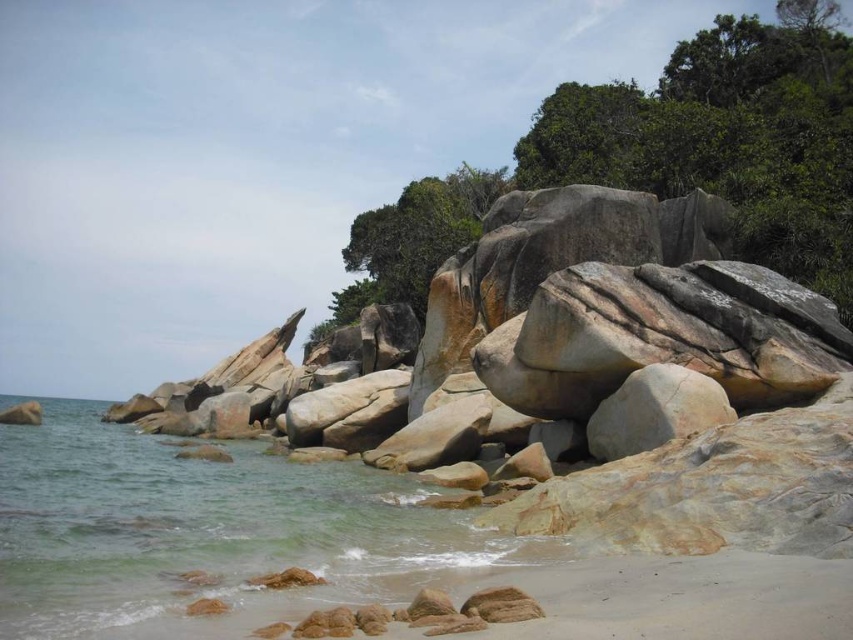
The image size is (853, 640). Describe the element at coordinates (651, 362) in the screenshot. I see `rustic stone boulders at center` at that location.

Is point (579, 500) positioned behind point (598, 99)?

No, it is in front of (598, 99).

Is point (556, 356) behind point (465, 182)?

No, it is not.

Image resolution: width=853 pixels, height=640 pixels. Identify the location of rustic stone boulders at center. (651, 362).

Who is more distant from viewer, [173,486] or [811,93]?

Positioned behind is point [811,93].

Can you confirm if clear water at lower left is bigger than green leafy tree at upper center?

No, clear water at lower left is not bigger than green leafy tree at upper center.

Locate an element on the screen. Image resolution: width=853 pixels, height=640 pixels. clear water at lower left is located at coordinates (201, 531).

Can you confirm if green leafy tree at upper center is positioned to the left of green textured tree at upper center?

In fact, green leafy tree at upper center is to the right of green textured tree at upper center.

Is point (808, 196) positioned behind point (337, 304)?

No.

What are the coordinates of `green leafy tree at upper center` in the screenshot? It's located at (660, 161).